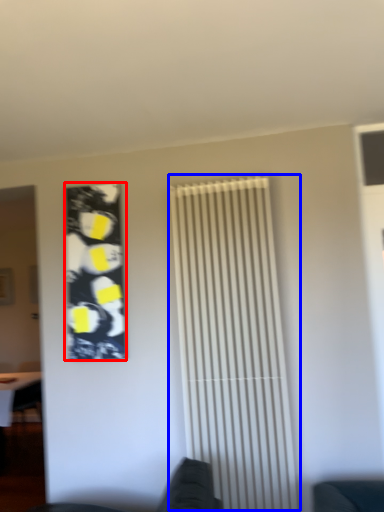
Question: Which of the following is the closest to the observer, poster (highlighted by a red box) or shutter (highlighted by a blue box)?

Choices:
 (A) poster
 (B) shutter

Answer: (B)